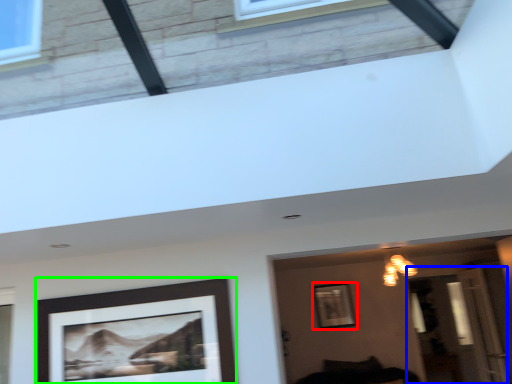
Question: Which is farther away from picture frame (highlighted by a red box)? glass door (highlighted by a blue box) or picture frame (highlighted by a green box)?

Choices:
 (A) glass door
 (B) picture frame

Answer: (B)